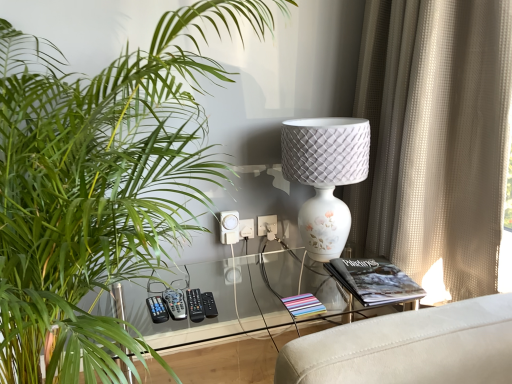
The width and height of the screenshot is (512, 384). I want to click on gray plastic remote at lower center, the 1th control in the left-to-right sequence, so click(x=175, y=303).

Locate an element on the screen. white plastic electric outlet at center, which is the 2th electric outlet from left to right is located at coordinates (266, 223).

In order to face white textured lamp at center, should I rotate leftwards or rightwards?

A 9.039 degree turn to the right will do.

Where is `gray plastic remote at lower center, the 1th control in the left-to-right sequence`? The width and height of the screenshot is (512, 384). gray plastic remote at lower center, the 1th control in the left-to-right sequence is located at coordinates (175, 303).

Is point (74, 372) less distant than point (375, 286)?

That is True.

Considering the relative sizes of green leafy plant at left and black matte book at right in the image provided, is green leafy plant at left smaller than black matte book at right?

Incorrect, green leafy plant at left is not smaller in size than black matte book at right.

Does green leafy plant at left turn towards black matte book at right?

No, green leafy plant at left does not turn towards black matte book at right.

From the image's perspective, is green leafy plant at left above or below black matte book at right?

green leafy plant at left is above black matte book at right.

Is black plastic remote at center, marked as the third control in a left-to-right arrangement, behind transparent glass table at center?

Yes, it is.

Is black plastic remote at center, marked as the third control in a left-to-right arrangement, oriented away from transparent glass table at center?

No, black plastic remote at center, marked as the third control in a left-to-right arrangement,'s orientation is not away from transparent glass table at center.

Is black plastic remote at center, which ranks as the first control in right-to-left order, wider than transparent glass table at center?

Incorrect, the width of black plastic remote at center, which ranks as the first control in right-to-left order, does not surpass that of transparent glass table at center.

Looking at this image, is black plastic remote at center, marked as the third control in a left-to-right arrangement, not close to transparent glass table at center?

No, black plastic remote at center, marked as the third control in a left-to-right arrangement, is in close proximity to transparent glass table at center.

From the picture: Could you tell me if beige textured curtain at right is facing transparent glass table at center?

Yes.

How far apart are beige textured curtain at right and transparent glass table at center?

They are 22.38 inches apart.

Can you confirm if beige textured curtain at right is positioned to the right of transparent glass table at center?

Correct, you'll find beige textured curtain at right to the right of transparent glass table at center.

Between beige textured curtain at right and transparent glass table at center, which one has smaller size?

beige textured curtain at right is smaller.

How many degrees apart are the facing directions of white plastic electric outlet at center, the 1th electric outlet from the right, and transparent glass table at center?

2.91 degrees.

Based on the photo, is white plastic electric outlet at center, the 1th electric outlet from the right, at the right side of transparent glass table at center?

Incorrect, white plastic electric outlet at center, the 1th electric outlet from the right, is not on the right side of transparent glass table at center.

Is white plastic electric outlet at center, which is the 2th electric outlet from left to right, far from transparent glass table at center?

Actually, white plastic electric outlet at center, which is the 2th electric outlet from left to right, and transparent glass table at center are a little close together.

Is point (269, 223) closer or farther from the camera than point (200, 334)?

Point (269, 223) is closer to the camera than point (200, 334).

Consider the image. Is there a large distance between black plastic remote at center, which appears as the 2th control when viewed from the left, and white plastic electric outlet at center, which is counted as the 1th electric outlet, starting from the left?

They are positioned close to each other.

Is black plastic remote at center, which appears as the 2th control when viewed from the left, turned away from white plastic electric outlet at center, which is the second electric outlet from right to left?

No, white plastic electric outlet at center, which is the second electric outlet from right to left, is not at the back of black plastic remote at center, which appears as the 2th control when viewed from the left.

Looking at this image, which object is closer to the camera taking this photo, black plastic remote at center, the second control from the right, or white plastic electric outlet at center, which is counted as the 1th electric outlet, starting from the left?

black plastic remote at center, the second control from the right, is in front.

From the image's perspective, which one is positioned higher, green leafy plant at left or black plastic remote at center, marked as the third control in a left-to-right arrangement?

From the image's view, green leafy plant at left is above.

From a real-world perspective, is green leafy plant at left physically located above or below black plastic remote at center, which ranks as the first control in right-to-left order?

Clearly, from a real-world perspective, green leafy plant at left is above black plastic remote at center, which ranks as the first control in right-to-left order.

Considering the sizes of green leafy plant at left and black plastic remote at center, which ranks as the first control in right-to-left order, in the image, is green leafy plant at left taller or shorter than black plastic remote at center, which ranks as the first control in right-to-left order,?

In the image, green leafy plant at left appears to be taller than black plastic remote at center, which ranks as the first control in right-to-left order.

Between beige textured curtain at right and white textured lamp at center, which one has larger width?

white textured lamp at center is wider.

Is the surface of beige textured curtain at right in direct contact with white textured lamp at center?

No.

Find the location of a particular element. The image size is (512, 384). curtain above the white textured lamp at center (from a real-world perspective) is located at coordinates (435, 138).

Relative to white textured lamp at center, is beige textured curtain at right in front or behind?

In the image, beige textured curtain at right appears in front of white textured lamp at center.

Locate an element on the screen. houseplant on the left of black matte book at right is located at coordinates click(x=98, y=182).

There is a transparent glass table at center. Where is `the 1st control above it (from the image's perspective)`? The height and width of the screenshot is (384, 512). the 1st control above it (from the image's perspective) is located at coordinates (209, 305).

Which object lies nearer to the anchor point gray plastic remote at lower center, the 1th control in the left-to-right sequence, black plastic remote at center, which appears as the 2th control when viewed from the left, or black matte book at right?

Among the two, black plastic remote at center, which appears as the 2th control when viewed from the left, is located nearer to gray plastic remote at lower center, the 1th control in the left-to-right sequence.

Estimate the real-world distances between objects in this image. Which object is closer to white plastic electric outlet at center, which is the second electric outlet from right to left, black plastic remote at center, which appears as the 2th control when viewed from the left, or white plastic electric outlet at center, the 1th electric outlet from the right?

white plastic electric outlet at center, the 1th electric outlet from the right, lies closer to white plastic electric outlet at center, which is the second electric outlet from right to left, than the other object.

Looking at the image, which one is located closer to black matte book at right, black plastic remote at center, marked as the third control in a left-to-right arrangement, or gray plastic remote at lower center, the 1th control in the left-to-right sequence?

black plastic remote at center, marked as the third control in a left-to-right arrangement, is closer to black matte book at right.

Considering their positions, is white plastic electric outlet at center, which is counted as the 1th electric outlet, starting from the left, positioned further to gray plastic remote at lower center, the 1th control in the left-to-right sequence, than green leafy plant at left?

green leafy plant at left is positioned further to the anchor gray plastic remote at lower center, the 1th control in the left-to-right sequence.

Which object lies nearer to the anchor point white textured lamp at center, white plastic electric outlet at center, which is the second electric outlet from right to left, or green leafy plant at left?

The object closer to white textured lamp at center is white plastic electric outlet at center, which is the second electric outlet from right to left.

Considering their positions, is black plastic remote at center, which appears as the 2th control when viewed from the left, positioned further to gray plastic remote at lower center, the 1th control in the left-to-right sequence, than white plastic electric outlet at center, which is the 2th electric outlet from left to right?

white plastic electric outlet at center, which is the 2th electric outlet from left to right, lies further to gray plastic remote at lower center, the 1th control in the left-to-right sequence, than the other object.

From the image, which object appears to be nearer to black plastic remote at center, which ranks as the first control in right-to-left order, black plastic remote at center, the second control from the right, or black matte book at right?

black plastic remote at center, the second control from the right.

Based on their spatial positions, is white plastic electric outlet at center, which is the second electric outlet from right to left, or black plastic remote at center, which ranks as the first control in right-to-left order, further from green leafy plant at left?

white plastic electric outlet at center, which is the second electric outlet from right to left, is further to green leafy plant at left.

Identify the location of book between black plastic remote at center, which ranks as the first control in right-to-left order, and beige textured curtain at right. The height and width of the screenshot is (384, 512). (374, 281).

Where is `lamp between black plastic remote at center, marked as the third control in a left-to-right arrangement, and black matte book at right`? The width and height of the screenshot is (512, 384). lamp between black plastic remote at center, marked as the third control in a left-to-right arrangement, and black matte book at right is located at coordinates (325, 176).

Where is `electric outlet located between beige textured curtain at right and white plastic electric outlet at center, which is the 2th electric outlet from left to right, in the depth direction`? The width and height of the screenshot is (512, 384). electric outlet located between beige textured curtain at right and white plastic electric outlet at center, which is the 2th electric outlet from left to right, in the depth direction is located at coordinates (246, 228).

At what (x,y) coordinates should I click in order to perform the action: click on lamp between gray plastic remote at lower center, the 3th control viewed from the right, and white plastic electric outlet at center, which is counted as the 1th electric outlet, starting from the left, from front to back. Please return your answer as a coordinate pair (x, y). The height and width of the screenshot is (384, 512). Looking at the image, I should click on (325, 176).